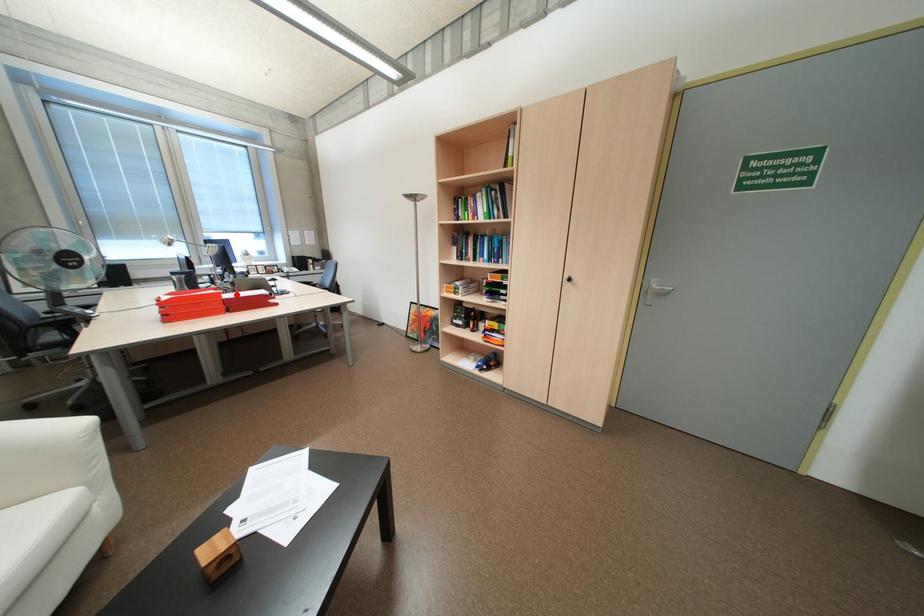
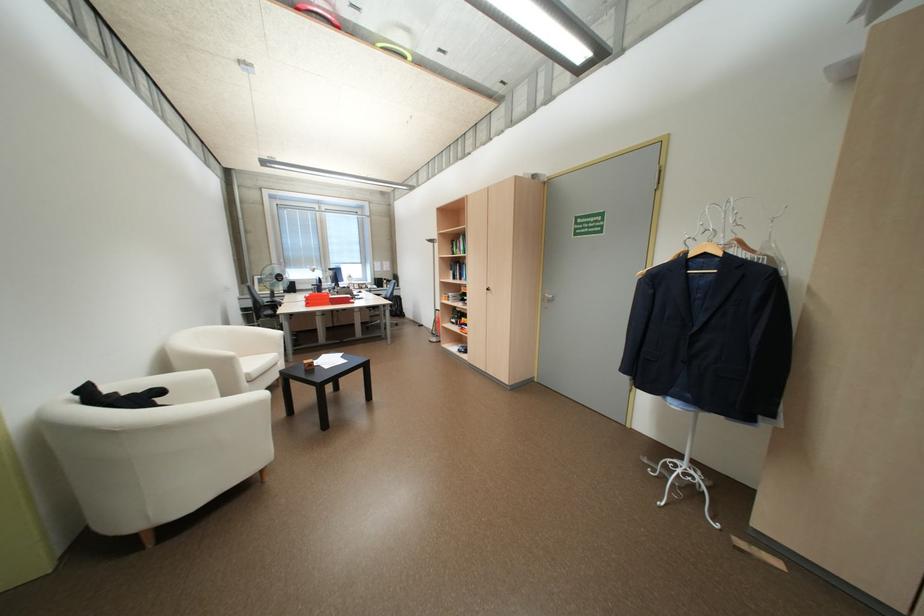
Question: I am providing you with two images of the same scene from different viewpoints. Given a red point in image1, look at the same physical point in image2. Is it:

Choices:
 (A) Closer to the viewpoint
 (B) Farther from the viewpoint

Answer: (A)